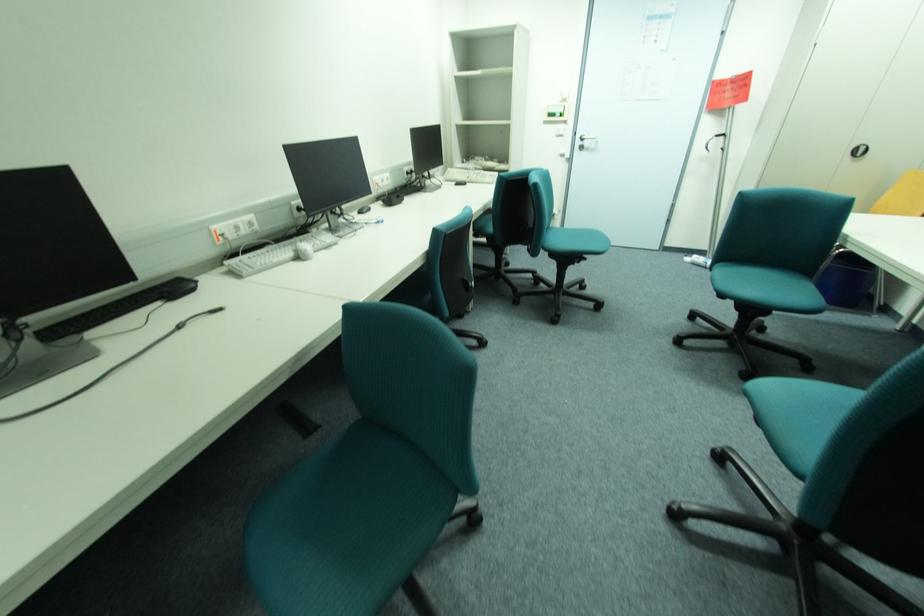
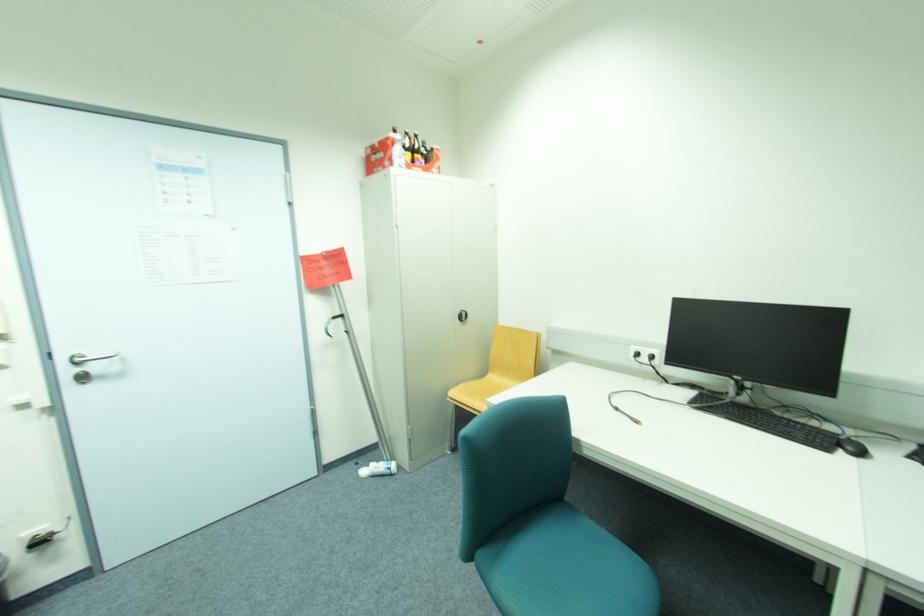
Locate, in the second image, the point that corresponds to (x=585, y=144) in the first image.

(74, 371)